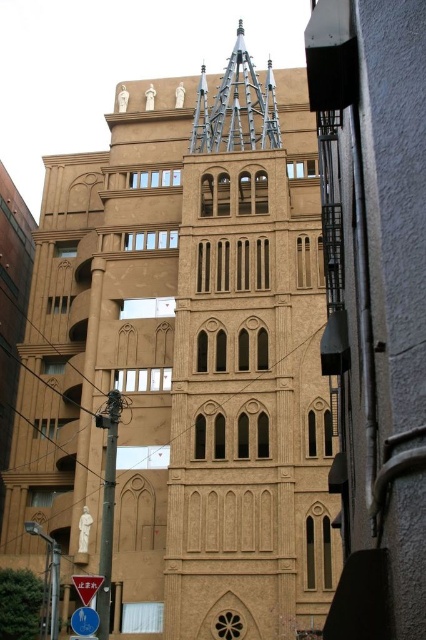
You are standing in front of the building and want to know if the point at coordinate point (247,81) is closer to you than the point at coordinate point (86,580). Can you determine this based on the building structure?

Yes, the point at coordinate point (247,81) is closer to you than the point at coordinate point (86,580) because it is further to the viewer in the image.

You are standing in front of the building and want to locate the shiny silver spire at center and the blue glossy sign at lower left. Which one is more to the left?

The blue glossy sign at lower left is more to the left because the shiny silver spire at center is positioned on the right side of it.